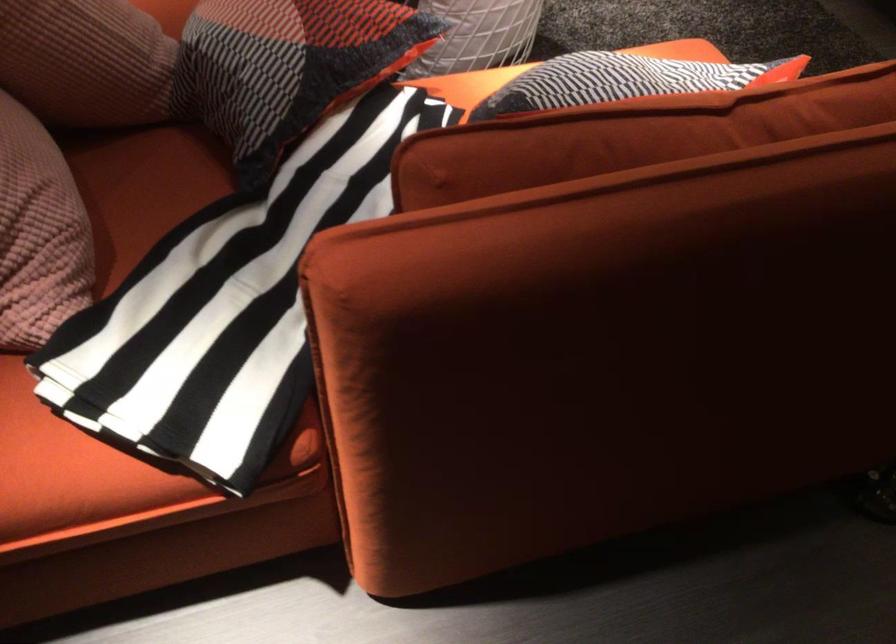
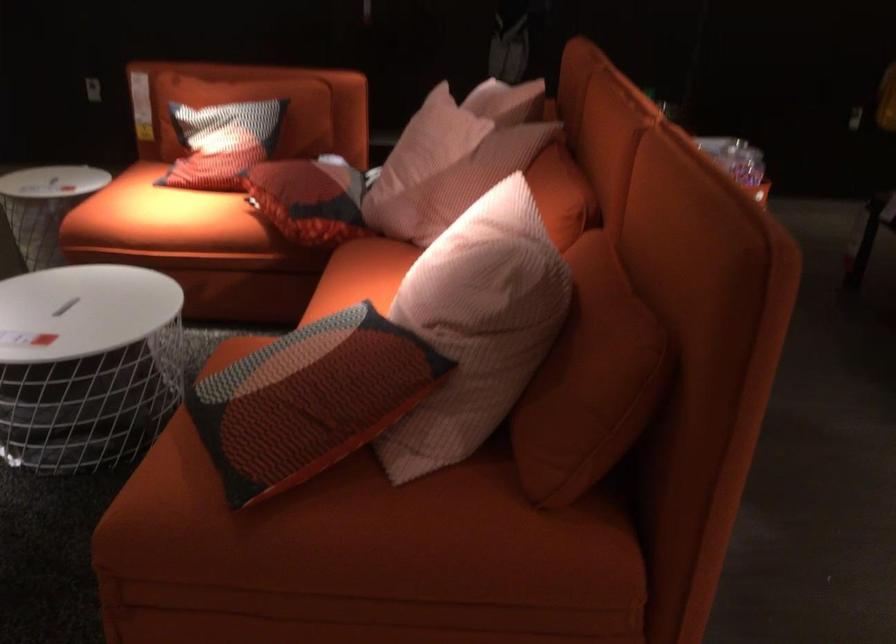
Question: I am providing you with two images of the same scene from different viewpoints. Please identify which objects are invisible in image2.

Choices:
 (A) sofa armrest
 (B) red patterned pillow
 (C) pink striped pillow
 (D) cardboard envelope

Answer: (A)